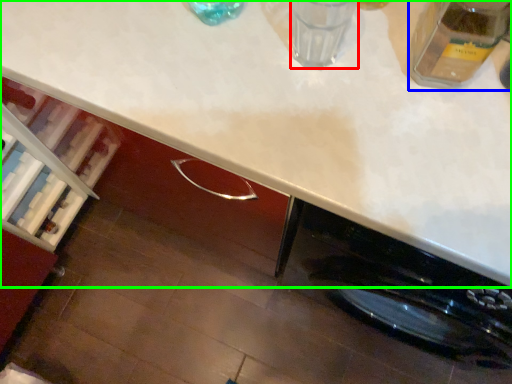
Question: Which object is positioned closest to water (highlighted by a red box)? Select from glass jar (highlighted by a blue box) and countertop (highlighted by a green box).

Choices:
 (A) glass jar
 (B) countertop

Answer: (A)